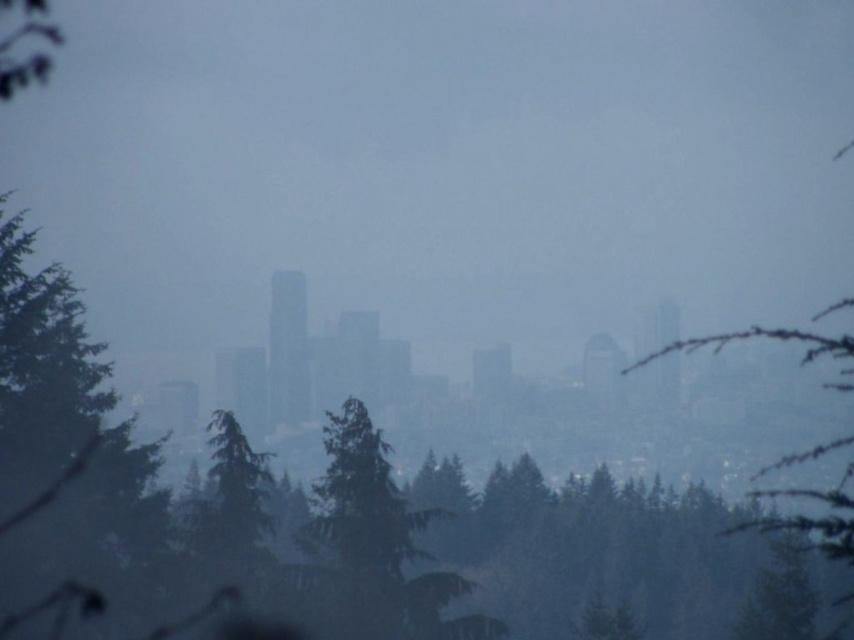
Question: Which object is farther from the camera taking this photo?

Choices:
 (A) green textured tree at center
 (B) green matte tree at upper left

Answer: (B)

Question: Is green textured tree at center positioned at the back of green matte tree at upper left?

Choices:
 (A) yes
 (B) no

Answer: (B)

Question: Does green textured tree at center appear under green matte tree at upper left?

Choices:
 (A) yes
 (B) no

Answer: (A)

Question: Is green textured tree at center closer to camera compared to green matte tree at upper left?

Choices:
 (A) no
 (B) yes

Answer: (B)